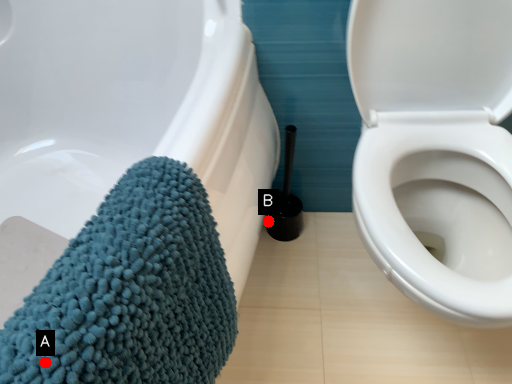
Question: Two points are circled on the image, labeled by A and B beside each circle. Which point is closer to the camera taking this photo?

Choices:
 (A) A is closer
 (B) B is closer

Answer: (A)